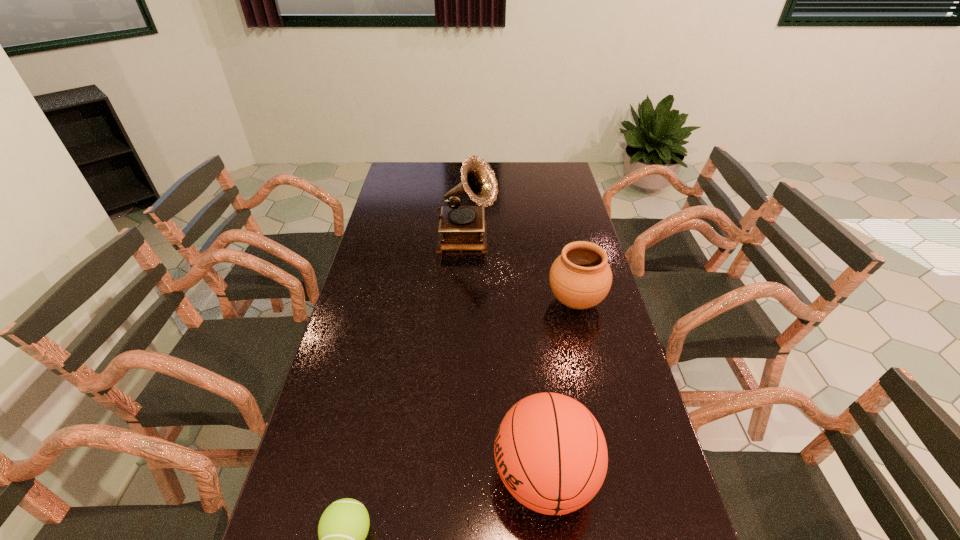
At what (x,y) coordinates should I click in order to perform the action: click on the farthest object. Please return your answer as a coordinate pair (x, y). The height and width of the screenshot is (540, 960). Looking at the image, I should click on (461, 228).

Find the location of a particular element. The width and height of the screenshot is (960, 540). record player is located at coordinates (461, 228).

At what (x,y) coordinates should I click in order to perform the action: click on the second tallest object. Please return your answer as a coordinate pair (x, y). The image size is (960, 540). Looking at the image, I should click on (551, 454).

Locate an element on the screen. the third tallest object is located at coordinates (580, 278).

I want to click on the second farthest object, so click(x=580, y=278).

Where is `free region located 0.150m on the horn of the farthest object`? Image resolution: width=960 pixels, height=540 pixels. free region located 0.150m on the horn of the farthest object is located at coordinates (536, 240).

Locate an element on the screen. The height and width of the screenshot is (540, 960). free space located 0.130m on the side with logo of the basketball is located at coordinates (436, 477).

At what (x,y) coordinates should I click in order to perform the action: click on vacant space located 0.330m on the side with logo of the basketball. Please return your answer as a coordinate pair (x, y). This screenshot has width=960, height=540. Looking at the image, I should click on (348, 477).

Find the location of a particular element. This screenshot has width=960, height=540. vacant space located 0.070m on the side with logo of the basketball is located at coordinates (462, 477).

Where is `free spot located on the back of the pottery`? The width and height of the screenshot is (960, 540). free spot located on the back of the pottery is located at coordinates (559, 230).